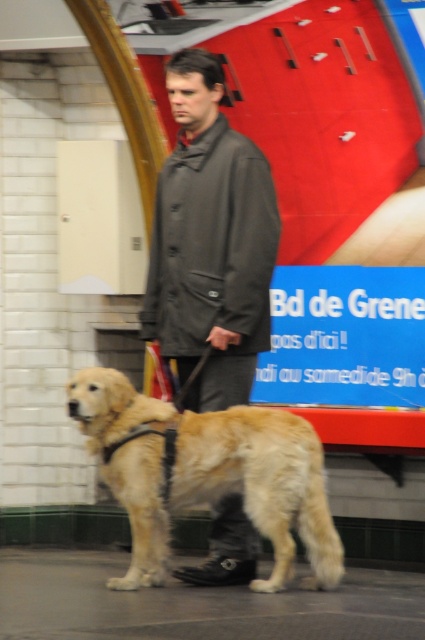
You are a security guard in the train station. You see the golden fur dog at center and the blue plastic sign at center. According to the sign, what should you do about the dog?

The blue plastic sign at center says that dogs are not allowed here, so you should ask the owner to remove the golden fur dog at center from the area.

You are standing in the train station and see two points marked on the floor. The first point is at coordinate point(x=305, y=465) and the second is at point(x=297, y=324). Which point is closer to you?

Point(x=305, y=465) is closer to the viewer than point(x=297, y=324).

You are a security guard in the train station and need to ensure that the golden fur dog at center is not blocking the walkway. Since the dark gray coat at center is in front of the dog, can you confirm if the dog is positioned behind the man?

The golden fur dog at center is behind the dark gray coat at center, so yes, the dog is positioned behind the man and not blocking the walkway.